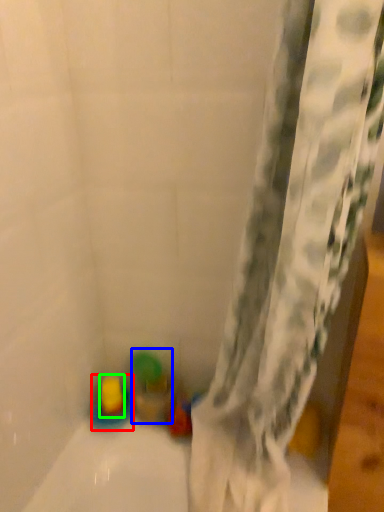
Question: Based on their relative distances, which object is farther from toy (highlighted by a red box)? Choose from toy (highlighted by a blue box) and toy (highlighted by a green box).

Choices:
 (A) toy
 (B) toy

Answer: (A)